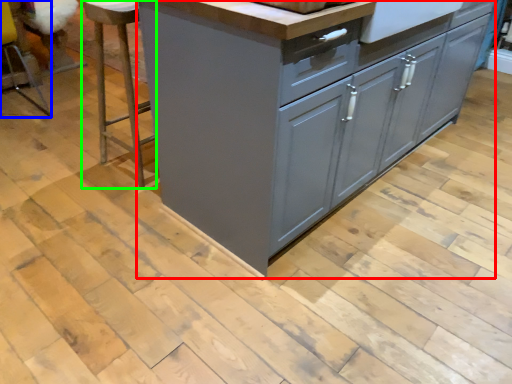
Question: Which object is the farthest from chest of drawers (highlighted by a red box)? Choose among these: bar stool (highlighted by a blue box) or bar stool (highlighted by a green box).

Choices:
 (A) bar stool
 (B) bar stool

Answer: (A)